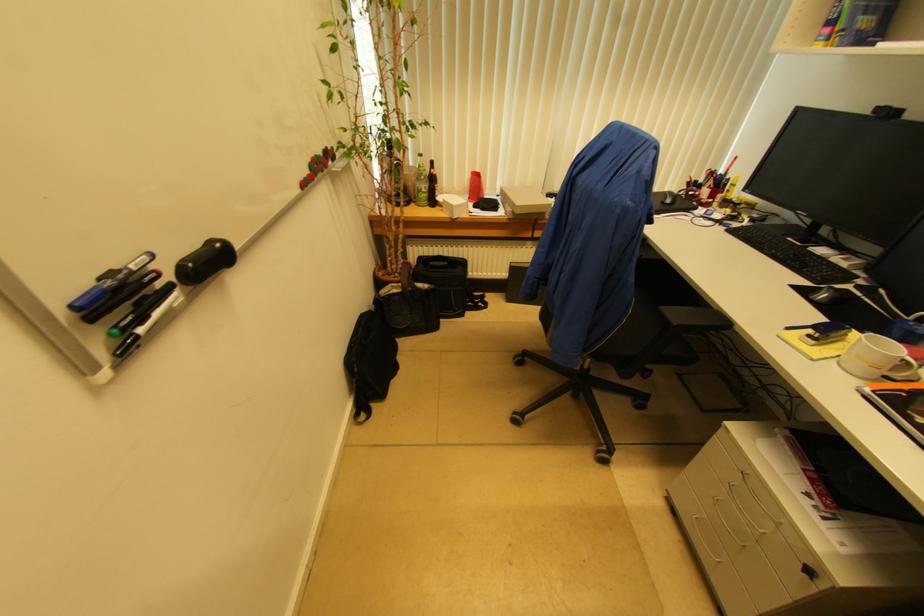
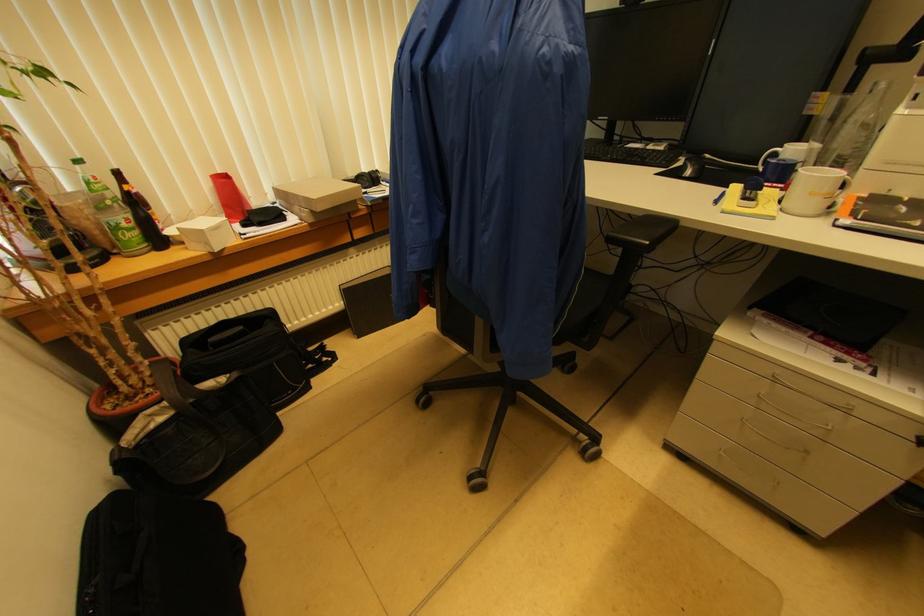
Where in the second image is the point corresponding to [404,290] from the first image?

(175, 408)